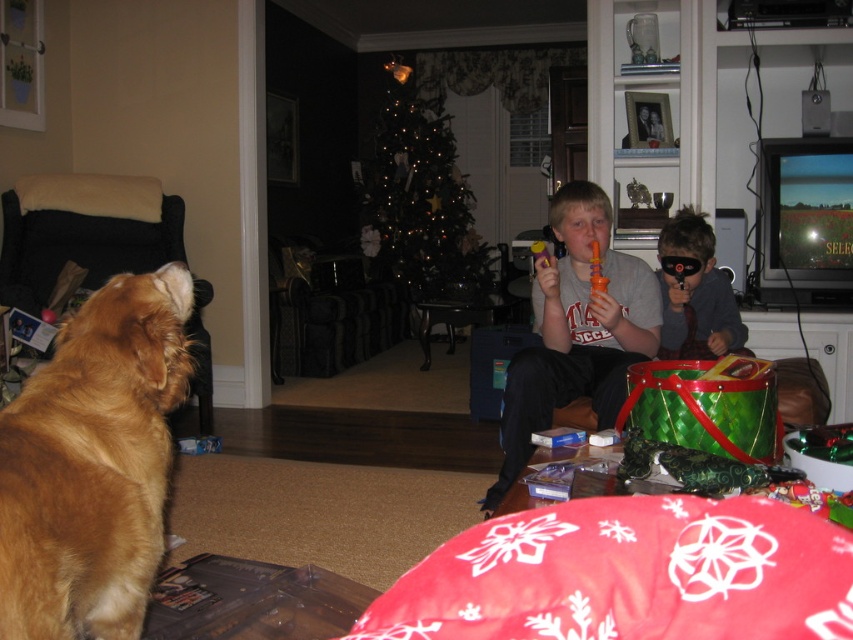
Describe the element at coordinates (93, 464) in the screenshot. I see `golden fur dog at left` at that location.

Is point (56, 508) closer to camera compared to point (595, 321)?

Yes, it is in front of point (595, 321).

The image size is (853, 640). In order to click on golden fur dog at left in this screenshot , I will do `click(93, 464)`.

Between point (404, 77) and point (738, 314), which one is positioned in front?

Point (738, 314) is in front.

Identify the location of illuminated glass christmas tree at center. This screenshot has width=853, height=640. [422, 195].

Which is in front, point (440, 285) or point (712, 346)?

Point (712, 346) is more forward.

This screenshot has height=640, width=853. Find the location of `illuminated glass christmas tree at center`. illuminated glass christmas tree at center is located at coordinates (422, 195).

Which is above, matte plastic toy at center or illuminated glass christmas tree at center?

illuminated glass christmas tree at center is above.

The width and height of the screenshot is (853, 640). I want to click on matte plastic toy at center, so click(x=576, y=330).